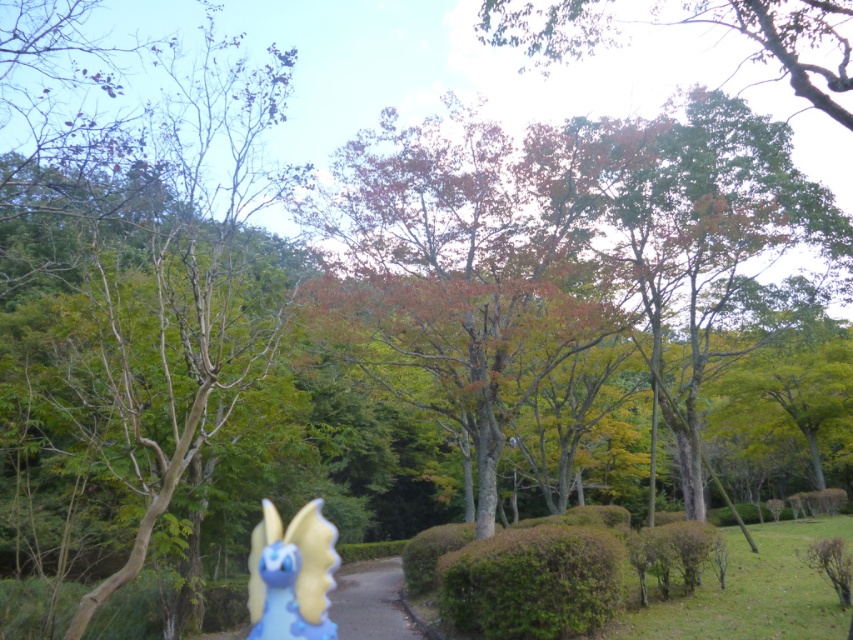
You are a park visitor who wants to take a photo of the brown matte tree at left and the blue matte figurine at lower left. Which object should you focus on first if you want to capture both in one frame without moving the camera?

You should focus on the brown matte tree at left first because it is larger than the blue matte figurine at lower left, so it will be more prominent in the frame.

You are a gardener planning to place a 3 meter wide decorative fountain between the green textured hedge at center and the green leafy tree at upper center. Will there be enough space for the fountain to fit between them?

The distance between the green textured hedge at center and the green leafy tree at upper center is 8.95 meters. Since the fountain is 3 meters wide, there is sufficient space to place it between them as 8.95 meters is greater than 3 meters.

You are walking along the path in the park and see the brown matte tree at left and the green textured hedge at center. Which object is positioned to the left of the other?

The brown matte tree at left is positioned to the left of the green textured hedge at center.